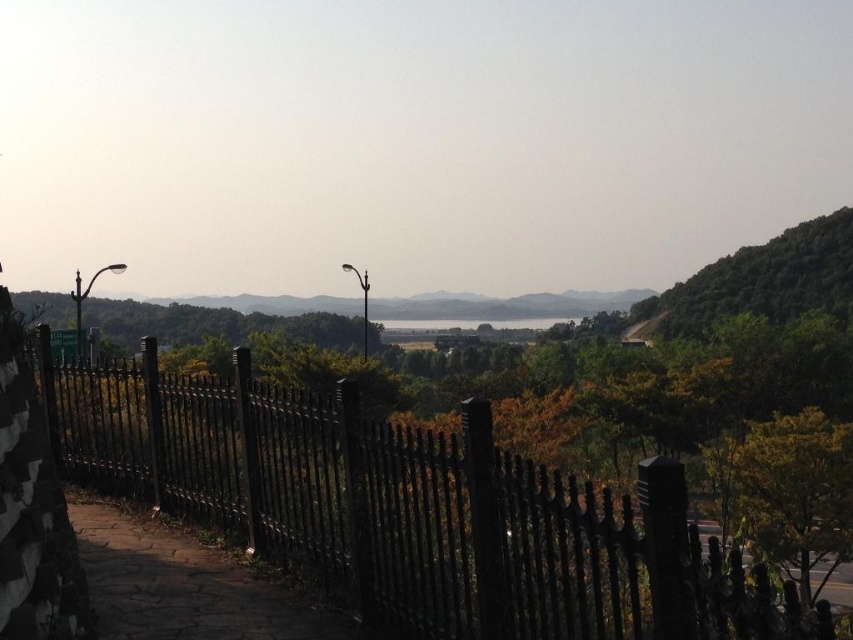
In the scene shown: Is black wrought iron fence at center below brown stone path at lower left?

Correct, black wrought iron fence at center is located below brown stone path at lower left.

Is black wrought iron fence at center above brown stone path at lower left?

Actually, black wrought iron fence at center is below brown stone path at lower left.

This screenshot has width=853, height=640. Describe the element at coordinates (410, 509) in the screenshot. I see `black wrought iron fence at center` at that location.

In order to click on black wrought iron fence at center in this screenshot , I will do `click(410, 509)`.